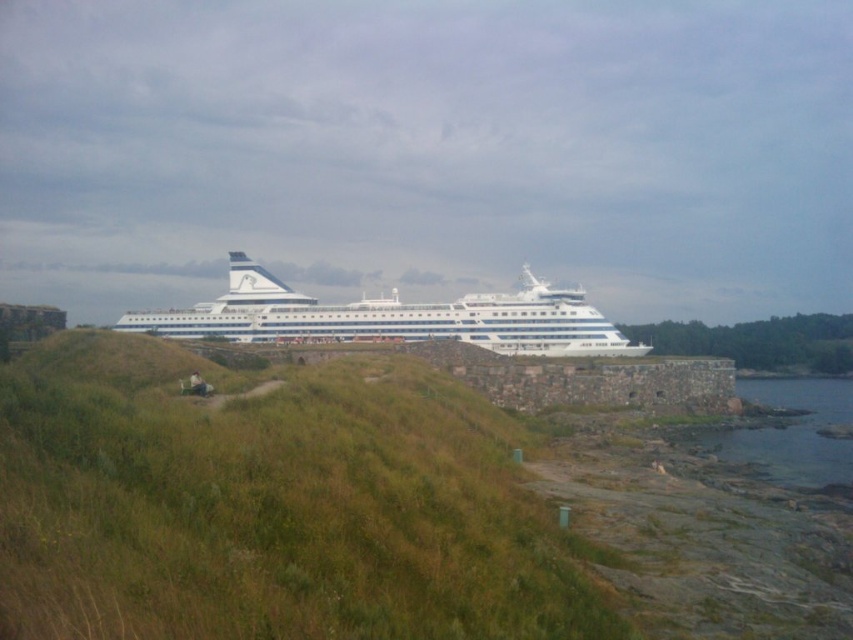
You are standing on the cruise ship and looking towards the shoreline. Where is the green grassy at center located in the image?

The green grassy at center is located at the 2D coordinates point of (x=270, y=506) in the image.

You are planning to walk from the grassy area to the water. Which area is wider, the green grassy at center or the clear water at lower right?

The clear water at lower right is wider than the green grassy at center.

You are a photographer planning to capture the white glossy cruise ship at center and the clear water at lower right in a single frame. Given that your camera has a limited field of view, which object should you prioritize framing first to ensure both are visible?

The white glossy cruise ship at center is wider than the clear water at lower right, so you should prioritize framing the white glossy cruise ship at center first to accommodate its larger width while still allowing space for the clear water at lower right in the frame.